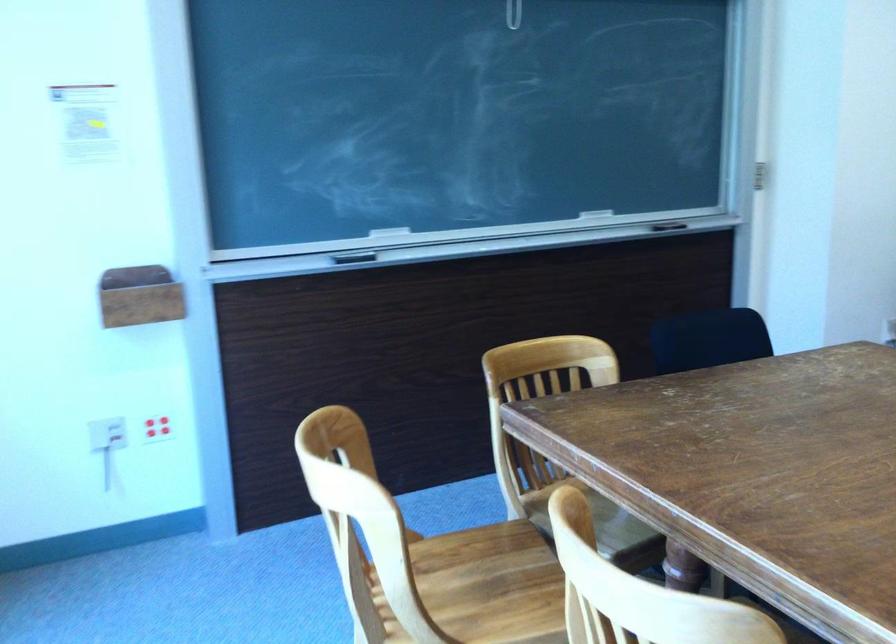
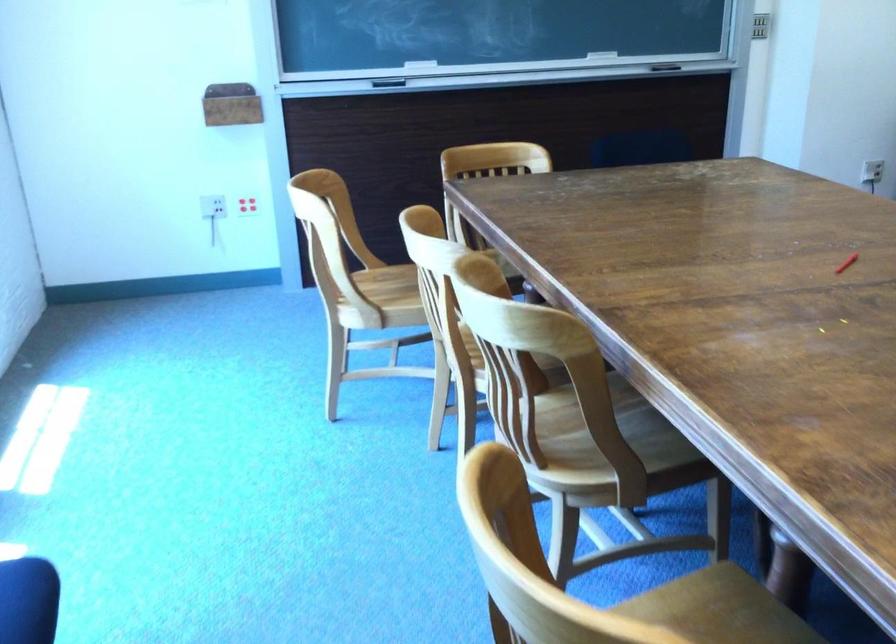
The point at (x=340, y=261) is marked in the first image. Where is the corresponding point in the second image?

(389, 82)